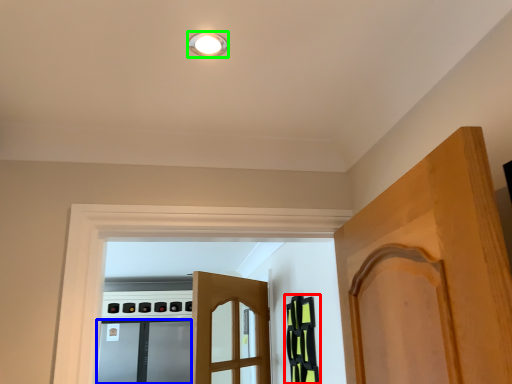
Question: Estimate the real-world distances between objects in this image. Which object is farther from cabinetry (highlighted by a red box), screen door (highlighted by a blue box) or light fixture (highlighted by a green box)?

Choices:
 (A) screen door
 (B) light fixture

Answer: (A)